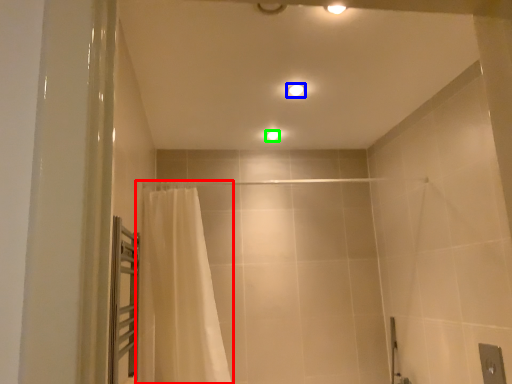
Question: Based on their relative distances, which object is farther from curtain (highlighted by a red box)? Choose from light fixture (highlighted by a blue box) and light fixture (highlighted by a green box).

Choices:
 (A) light fixture
 (B) light fixture

Answer: (B)